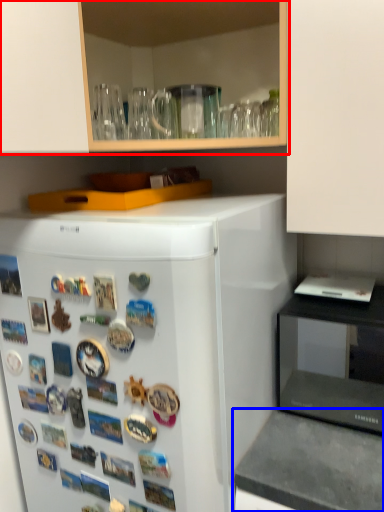
Question: Which object appears farthest to the camera in this image, cabinetry (highlighted by a red box) or counter top (highlighted by a blue box)?

Choices:
 (A) cabinetry
 (B) counter top

Answer: (A)